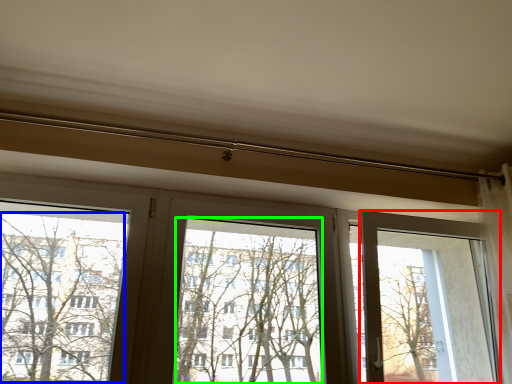
Question: Which is farther away from screen door (highlighted by a red box)? tree (highlighted by a blue box) or window screen (highlighted by a green box)?

Choices:
 (A) tree
 (B) window screen

Answer: (A)